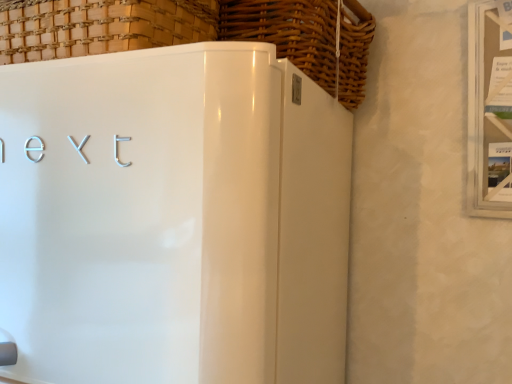
Where is `white glossy refrigerator at center`? The height and width of the screenshot is (384, 512). white glossy refrigerator at center is located at coordinates (173, 218).

The height and width of the screenshot is (384, 512). What are the coordinates of `woven wood basket at upper center, the 2th basket when ordered from left to right` in the screenshot? It's located at (308, 38).

Which is nearer, (82, 55) or (284, 358)?

The point (284, 358) is closer to the camera.

From a real-world perspective, is woven wood basket at upper left, the second basket in the right-to-left sequence, on white glossy refrigerator at center?

Indeed, from a real-world perspective, woven wood basket at upper left, the second basket in the right-to-left sequence, stands above white glossy refrigerator at center.

Could you tell me if woven wood basket at upper center, the 2th basket when ordered from left to right, is turned towards woven wood basket at upper left, the 1th basket viewed from the left?

Yes, woven wood basket at upper center, the 2th basket when ordered from left to right, is oriented towards woven wood basket at upper left, the 1th basket viewed from the left.

How many degrees apart are the facing directions of woven wood basket at upper center, the 1th basket from the right, and woven wood basket at upper left, the 1th basket viewed from the left?

The angle between the facing direction of woven wood basket at upper center, the 1th basket from the right, and the facing direction of woven wood basket at upper left, the 1th basket viewed from the left, is 14 degrees.

Looking at their sizes, would you say woven wood basket at upper center, the 2th basket when ordered from left to right, is wider or thinner than woven wood basket at upper left, the second basket in the right-to-left sequence?

Considering their sizes, woven wood basket at upper center, the 2th basket when ordered from left to right, looks broader than woven wood basket at upper left, the second basket in the right-to-left sequence.

Is point (302, 69) less distant than point (54, 17)?

No, (302, 69) is further to viewer.

Locate an element on the screen. This screenshot has width=512, height=384. the 1st basket located above the white glossy refrigerator at center (from a real-world perspective) is located at coordinates (100, 26).

Is white glossy refrigerator at center taller than woven wood basket at upper left, the second basket in the right-to-left sequence?

Indeed, white glossy refrigerator at center has a greater height compared to woven wood basket at upper left, the second basket in the right-to-left sequence.

Would you say white glossy refrigerator at center is outside woven wood basket at upper left, the second basket in the right-to-left sequence?

Yes, white glossy refrigerator at center is outside of woven wood basket at upper left, the second basket in the right-to-left sequence.

Is woven wood basket at upper left, the 1th basket viewed from the left, wider or thinner than woven wood basket at upper center, the 1th basket from the right?

In the image, woven wood basket at upper left, the 1th basket viewed from the left, appears to be more narrow than woven wood basket at upper center, the 1th basket from the right.

Which is more to the left, woven wood basket at upper left, the second basket in the right-to-left sequence, or woven wood basket at upper center, the 1th basket from the right?

woven wood basket at upper left, the second basket in the right-to-left sequence, is more to the left.

From the picture: Considering the relative sizes of woven wood basket at upper left, the second basket in the right-to-left sequence, and woven wood basket at upper center, the 1th basket from the right, in the image provided, is woven wood basket at upper left, the second basket in the right-to-left sequence, smaller than woven wood basket at upper center, the 1th basket from the right,?

No.

Is point (321, 14) closer or farther from the camera than point (278, 137)?

Point (321, 14) is positioned farther from the camera compared to point (278, 137).

From a real-world perspective, relative to white glossy refrigerator at center, is woven wood basket at upper center, the 2th basket when ordered from left to right, vertically above or below?

From a real-world perspective, woven wood basket at upper center, the 2th basket when ordered from left to right, is physically above white glossy refrigerator at center.

From the image's perspective, is woven wood basket at upper center, the 2th basket when ordered from left to right, under white glossy refrigerator at center?

Actually, woven wood basket at upper center, the 2th basket when ordered from left to right, appears above white glossy refrigerator at center in the image.

Based on their positions, is woven wood basket at upper center, the 2th basket when ordered from left to right, located to the left or right of white glossy refrigerator at center?

From the image, it's evident that woven wood basket at upper center, the 2th basket when ordered from left to right, is to the right of white glossy refrigerator at center.

Which of these two, white glossy refrigerator at center or woven wood basket at upper center, the 2th basket when ordered from left to right, is smaller?

woven wood basket at upper center, the 2th basket when ordered from left to right.

Is woven wood basket at upper center, the 2th basket when ordered from left to right, completely or partially inside white glossy refrigerator at center?

No, woven wood basket at upper center, the 2th basket when ordered from left to right, is not surrounded by white glossy refrigerator at center.

Who is more distant, white glossy refrigerator at center or woven wood basket at upper center, the 1th basket from the right?

woven wood basket at upper center, the 1th basket from the right, is more distant.

Consider the image. Between white glossy refrigerator at center and woven wood basket at upper center, the 2th basket when ordered from left to right, which one has larger width?

white glossy refrigerator at center is wider.

You are a GUI agent. You are given a task and a screenshot of the screen. Output one action in this format:
    pyautogui.click(x=<x>, y=<y>)
    Task: Click on the basket to the left of white glossy refrigerator at center
    This screenshot has height=384, width=512.
    Given the screenshot: What is the action you would take?
    pyautogui.click(x=100, y=26)

This screenshot has width=512, height=384. In the image, there is a woven wood basket at upper center, the 2th basket when ordered from left to right. Identify the location of basket below it (from the image's perspective). (100, 26).

Which object lies nearer to the anchor point woven wood basket at upper left, the 1th basket viewed from the left, woven wood basket at upper center, the 1th basket from the right, or white glossy refrigerator at center?

white glossy refrigerator at center lies closer to woven wood basket at upper left, the 1th basket viewed from the left, than the other object.

Which object lies nearer to the anchor point white glossy refrigerator at center, woven wood basket at upper left, the second basket in the right-to-left sequence, or woven wood basket at upper center, the 2th basket when ordered from left to right?

Among the two, woven wood basket at upper left, the second basket in the right-to-left sequence, is located nearer to white glossy refrigerator at center.

When comparing their distances from woven wood basket at upper center, the 1th basket from the right, does woven wood basket at upper left, the 1th basket viewed from the left, or white glossy refrigerator at center seem further?

Based on the image, white glossy refrigerator at center appears to be further to woven wood basket at upper center, the 1th basket from the right.

When comparing their distances from woven wood basket at upper center, the 2th basket when ordered from left to right, does white glossy refrigerator at center or woven wood basket at upper left, the 1th basket viewed from the left, seem further?

Among the two, white glossy refrigerator at center is located further to woven wood basket at upper center, the 2th basket when ordered from left to right.

Looking at the image, which one is located further to woven wood basket at upper left, the second basket in the right-to-left sequence, white glossy refrigerator at center or woven wood basket at upper center, the 2th basket when ordered from left to right?

woven wood basket at upper center, the 2th basket when ordered from left to right.

Considering their positions, is woven wood basket at upper center, the 1th basket from the right, positioned closer to white glossy refrigerator at center than woven wood basket at upper left, the second basket in the right-to-left sequence?

The object closer to white glossy refrigerator at center is woven wood basket at upper left, the second basket in the right-to-left sequence.

You are a GUI agent. You are given a task and a screenshot of the screen. Output one action in this format:
    pyautogui.click(x=<x>, y=<y>)
    Task: Click on the basket between woven wood basket at upper center, the 2th basket when ordered from left to right, and white glossy refrigerator at center, in the vertical direction
    
    Given the screenshot: What is the action you would take?
    pyautogui.click(x=100, y=26)